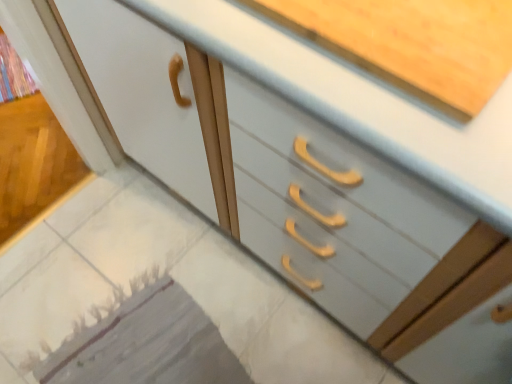
Question: From a real-world perspective, is white glossy countertop at upper center positioned above or below white glossy tile at lower left?

Choices:
 (A) below
 (B) above

Answer: (B)

Question: Relative to white glossy tile at lower left, is white glossy countertop at upper center in front or behind?

Choices:
 (A) front
 (B) behind

Answer: (A)

Question: Considering the relative positions of white glossy countertop at upper center and white glossy tile at lower left in the image provided, is white glossy countertop at upper center to the left or to the right of white glossy tile at lower left?

Choices:
 (A) left
 (B) right

Answer: (B)

Question: Would you say white glossy tile at lower left is inside or outside white glossy countertop at upper center?

Choices:
 (A) inside
 (B) outside

Answer: (B)

Question: Looking at the image, does white glossy tile at lower left seem bigger or smaller compared to white glossy countertop at upper center?

Choices:
 (A) big
 (B) small

Answer: (B)

Question: Considering the positions of white glossy tile at lower left and white glossy countertop at upper center in the image, is white glossy tile at lower left wider or thinner than white glossy countertop at upper center?

Choices:
 (A) wide
 (B) thin

Answer: (B)

Question: Considering the positions of white glossy tile at lower left and white glossy countertop at upper center in the image, is white glossy tile at lower left taller or shorter than white glossy countertop at upper center?

Choices:
 (A) short
 (B) tall

Answer: (A)